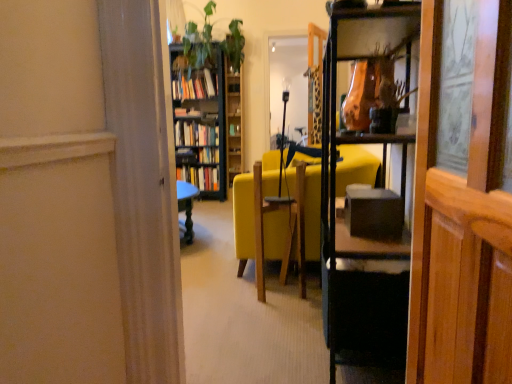
At what (x,y) coordinates should I click in order to perform the action: click on free point in front of wooden swivel chair at center. Please return your answer as a coordinate pair (x, y). The height and width of the screenshot is (384, 512). Looking at the image, I should click on (282, 308).